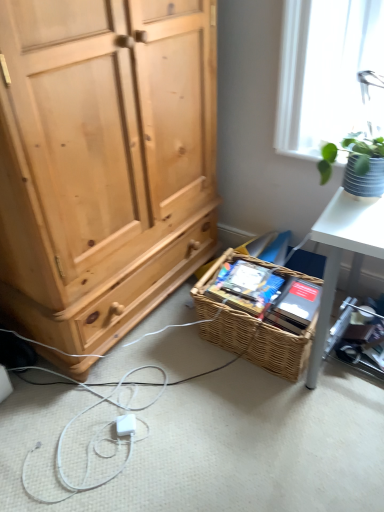
What do you see at coordinates (364, 165) in the screenshot? The height and width of the screenshot is (512, 384). I see `textured gray pot at upper right` at bounding box center [364, 165].

Where is `textured gray pot at upper right`? textured gray pot at upper right is located at coordinates (364, 165).

Are textured gray pot at upper right and white plastic desk at right beside each other?

No, textured gray pot at upper right is not making contact with white plastic desk at right.

In the image, there is a white plastic desk at right. Identify the location of houseplant above it (from the image's perspective). Image resolution: width=384 pixels, height=512 pixels. (364, 165).

Does point (373, 157) appear closer or farther from the camera than point (327, 230)?

Point (373, 157) is farther from the camera than point (327, 230).

Is white plastic desk at right inside textured gray pot at upper right?

No, white plastic desk at right is not surrounded by textured gray pot at upper right.

I want to click on picnic basket that appears behind the textured gray pot at upper right, so click(230, 308).

Can you confirm if textured gray pot at upper right is smaller than woven brown picnic basket at lower center?

Yes.

From the picture: Is textured gray pot at upper right completely or partially outside of woven brown picnic basket at lower center?

That's correct, textured gray pot at upper right is outside of woven brown picnic basket at lower center.

Which of these two, textured gray pot at upper right or woven brown picnic basket at lower center, stands shorter?

With less height is textured gray pot at upper right.

Which object is further away from the camera, woven brown picnic basket at lower center or textured gray pot at upper right?

woven brown picnic basket at lower center is further from the camera.

Considering the relative positions of woven brown picnic basket at lower center and textured gray pot at upper right in the image provided, is woven brown picnic basket at lower center to the left of textured gray pot at upper right from the viewer's perspective?

Indeed, woven brown picnic basket at lower center is positioned on the left side of textured gray pot at upper right.

Would you say woven brown picnic basket at lower center contains textured gray pot at upper right?

No, textured gray pot at upper right is not surrounded by woven brown picnic basket at lower center.

From the image's perspective, is woven brown picnic basket at lower center located beneath textured gray pot at upper right?

Correct, woven brown picnic basket at lower center appears lower than textured gray pot at upper right in the image.

From the image's perspective, which is below, woven brown picnic basket at lower center or white plastic desk at right?

white plastic desk at right is shown below in the image.

Is woven brown picnic basket at lower center in front of or behind white plastic desk at right in the image?

In the image, woven brown picnic basket at lower center appears in front of white plastic desk at right.

Consider the image. From a real-world perspective, which is physically below, woven brown picnic basket at lower center or white plastic desk at right?

white plastic desk at right is physically lower.

How different are the orientations of woven brown picnic basket at lower center and white plastic desk at right in degrees?

The angle between the facing direction of woven brown picnic basket at lower center and the facing direction of white plastic desk at right is 3.27 degrees.

Find the location of `desk that appears below the woven brown picnic basket at lower center (from the image's perspective)`. desk that appears below the woven brown picnic basket at lower center (from the image's perspective) is located at coordinates (341, 255).

Does white plastic desk at right come behind woven brown picnic basket at lower center?

Yes, white plastic desk at right is further from the viewer.

Can you confirm if white plastic desk at right is shorter than woven brown picnic basket at lower center?

Yes, white plastic desk at right is shorter than woven brown picnic basket at lower center.

Is textured gray pot at upper right surrounded by white plastic desk at right?

Actually, textured gray pot at upper right is outside white plastic desk at right.

Measure the distance between white plastic desk at right and textured gray pot at upper right.

white plastic desk at right and textured gray pot at upper right are 22.66 inches apart.

Between white plastic desk at right and textured gray pot at upper right, which one appears on the left side from the viewer's perspective?

From the viewer's perspective, textured gray pot at upper right appears more on the left side.

The width and height of the screenshot is (384, 512). I want to click on houseplant in front of the white plastic desk at right, so click(364, 165).

Identify the location of picnic basket located on the left of textured gray pot at upper right. This screenshot has height=512, width=384. (230, 308).

From the image, which object appears to be nearer to textured gray pot at upper right, white plastic desk at right or woven brown picnic basket at lower center?

Based on the image, white plastic desk at right appears to be nearer to textured gray pot at upper right.

Estimate the real-world distances between objects in this image. Which object is closer to white plastic desk at right, textured gray pot at upper right or woven brown picnic basket at lower center?

The object closer to white plastic desk at right is woven brown picnic basket at lower center.

From the image, which object appears to be nearer to textured gray pot at upper right, woven brown picnic basket at lower center or white plastic desk at right?

white plastic desk at right is positioned closer to the anchor textured gray pot at upper right.

Estimate the real-world distances between objects in this image. Which object is further from woven brown picnic basket at lower center, white plastic desk at right or textured gray pot at upper right?

Among the two, textured gray pot at upper right is located further to woven brown picnic basket at lower center.

From the image, which object appears to be nearer to white plastic desk at right, woven brown picnic basket at lower center or textured gray pot at upper right?

Among the two, woven brown picnic basket at lower center is located nearer to white plastic desk at right.

Considering their positions, is textured gray pot at upper right positioned further to woven brown picnic basket at lower center than white plastic desk at right?

textured gray pot at upper right is positioned further to the anchor woven brown picnic basket at lower center.

Locate an element on the screen. The width and height of the screenshot is (384, 512). picnic basket between textured gray pot at upper right and white plastic desk at right in the up-down direction is located at coordinates (x=230, y=308).